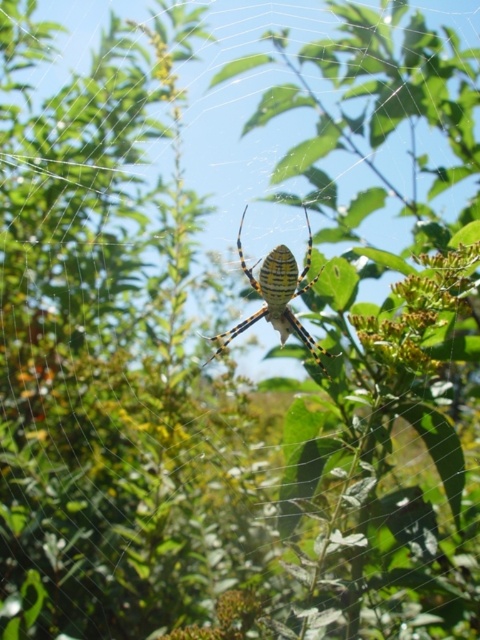
Question: Which object is closer to the camera taking this photo?

Choices:
 (A) yellow striped spider at center
 (B) yellow-green textured flower at center-right

Answer: (B)

Question: From the image, what is the correct spatial relationship of yellow-green textured flower at center-right in relation to yellow striped spider at center?

Choices:
 (A) right
 (B) left

Answer: (A)

Question: Is yellow-green textured flower at center-right behind yellow striped spider at center?

Choices:
 (A) no
 (B) yes

Answer: (A)

Question: Does yellow-green textured flower at center-right have a lesser width compared to yellow striped spider at center?

Choices:
 (A) yes
 (B) no

Answer: (A)